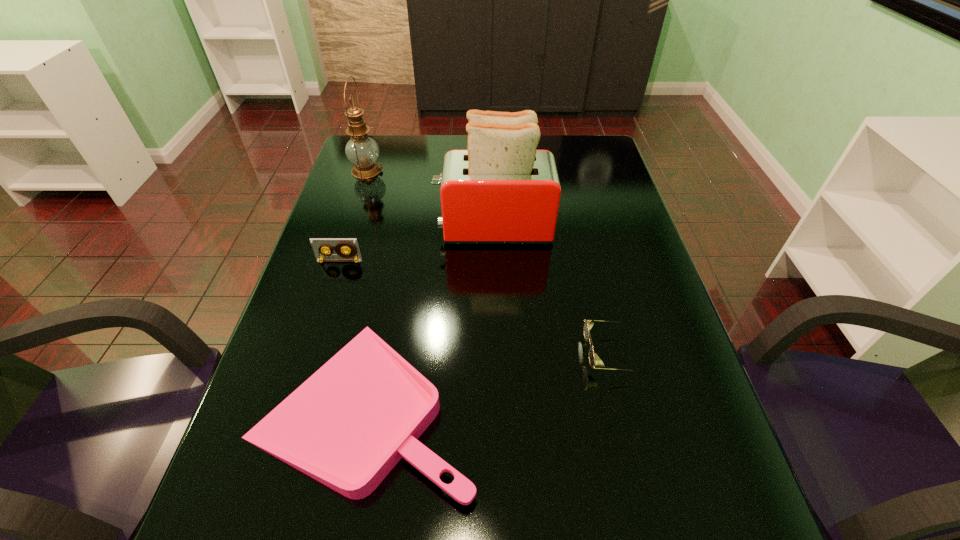
You are a GUI agent. You are given a task and a screenshot of the screen. Output one action in this format:
    pyautogui.click(x=<x>, y=<y>)
    Task: Click on the free spot between the fourth tallest object and the shortest object
    
    Given the screenshot: What is the action you would take?
    pyautogui.click(x=489, y=380)

Locate an element on the screen. The image size is (960, 540). free space between the farthest object and the third nearest object is located at coordinates (353, 216).

The height and width of the screenshot is (540, 960). Identify the location of empty space between the fourth tallest object and the oil lamp. (489, 262).

Image resolution: width=960 pixels, height=540 pixels. I want to click on free space between the second farthest object and the rightmost object, so click(552, 291).

Find the location of a particular element. The width and height of the screenshot is (960, 540). free space between the toaster and the rightmost object is located at coordinates point(552,291).

Where is `free space that is in between the third tallest object and the farthest object`? This screenshot has width=960, height=540. free space that is in between the third tallest object and the farthest object is located at coordinates (353, 216).

Find the location of a particular element. The width and height of the screenshot is (960, 540). vacant space that's between the third tallest object and the dustpan is located at coordinates (352, 333).

At what (x,y) coordinates should I click in order to perform the action: click on vacant area between the sunglasses and the oil lamp. Please return your answer as a coordinate pair (x, y). The image size is (960, 540). Looking at the image, I should click on (489, 262).

Locate an element on the screen. object that is the third closest to the fourth tallest object is located at coordinates (319, 245).

Locate which object is the fourth closest to the videotape. Please provide its 2D coordinates. Your answer should be formatted as a tuple, i.e. [(x, y)], where the tuple contains the x and y coordinates of a point satisfying the conditions above.

[(594, 360)]